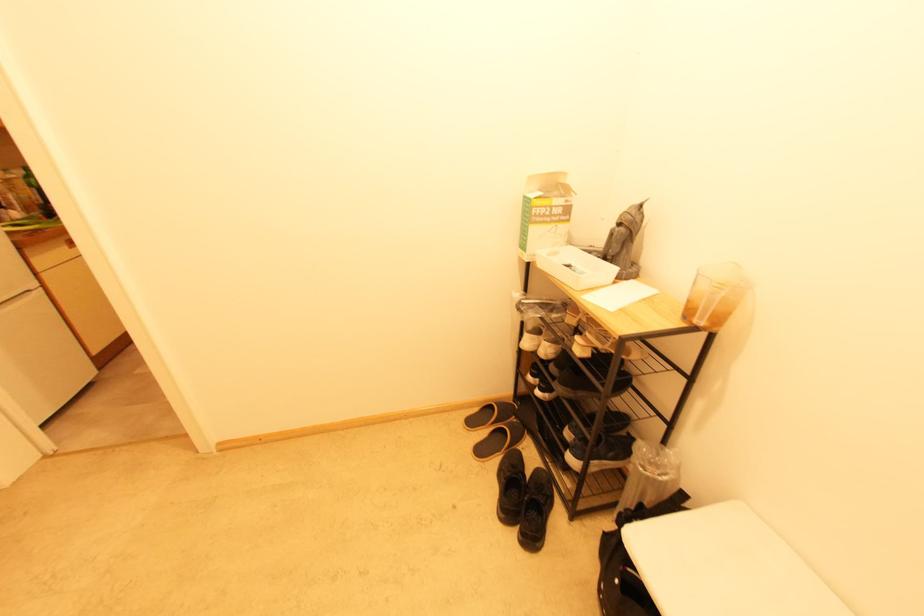
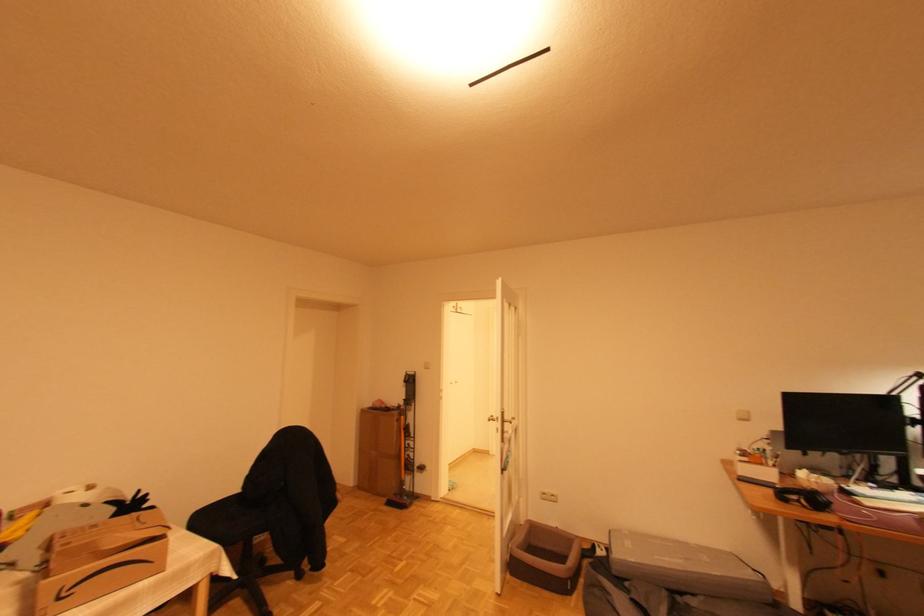
Question: I am providing you with two images of the same scene from different viewpoints. Which of the following objects are not visible in image2?

Choices:
 (A) small orange jar
 (B) cardboard amazon box
 (C) cardboard mask box
 (D) metal door handle

Answer: (C)